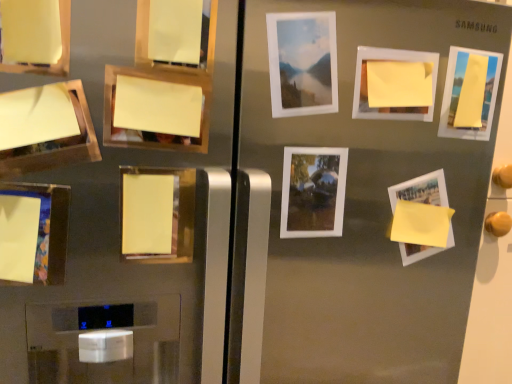
Question: Does matte yellow paper at upper left, which is the 3th picture frame in left-to-right order, have a greater height compared to yellow paper at upper left, the 10th picture frame positioned from the right?

Choices:
 (A) yes
 (B) no

Answer: (A)

Question: From the image's perspective, is matte yellow paper at upper left, which is the 3th picture frame in left-to-right order, on yellow paper at upper left, which appears as the 2th picture frame when viewed from the left?

Choices:
 (A) yes
 (B) no

Answer: (A)

Question: Is matte yellow paper at upper left, the ninth picture frame from the right, closer to camera compared to yellow paper at upper left, which appears as the 2th picture frame when viewed from the left?

Choices:
 (A) no
 (B) yes

Answer: (B)

Question: Considering the relative sizes of matte yellow paper at upper left, which is the 3th picture frame in left-to-right order, and yellow paper at upper left, which appears as the 2th picture frame when viewed from the left, in the image provided, is matte yellow paper at upper left, which is the 3th picture frame in left-to-right order, wider than yellow paper at upper left, which appears as the 2th picture frame when viewed from the left,?

Choices:
 (A) no
 (B) yes

Answer: (A)

Question: Does matte yellow paper at upper left, which is the 3th picture frame in left-to-right order, appear on the left side of yellow paper at upper left, the 10th picture frame positioned from the right?

Choices:
 (A) no
 (B) yes

Answer: (A)

Question: Would you say matte yellow paper at lower left, arranged as the 1th picture frame when viewed from the left, is inside or outside yellow matte paper at upper right, positioned as the third picture frame in right-to-left order?

Choices:
 (A) inside
 (B) outside

Answer: (B)

Question: From the image's perspective, is matte yellow paper at lower left, which appears as the 11th picture frame when viewed from the right, positioned above or below yellow matte paper at upper right, positioned as the third picture frame in right-to-left order?

Choices:
 (A) below
 (B) above

Answer: (A)

Question: Is point (13, 269) closer or farther from the camera than point (357, 54)?

Choices:
 (A) closer
 (B) farther

Answer: (A)

Question: From a real-world perspective, relative to yellow matte paper at upper right, positioned as the third picture frame in right-to-left order, is matte yellow paper at lower left, arranged as the 1th picture frame when viewed from the left, vertically above or below?

Choices:
 (A) above
 (B) below

Answer: (B)

Question: Considering the positions of yellow paper at upper left, the fifth picture frame when ordered from left to right, and matte white picture frame at upper center, which is counted as the 5th picture frame, starting from the right, in the image, is yellow paper at upper left, the fifth picture frame when ordered from left to right, wider or thinner than matte white picture frame at upper center, which is counted as the 5th picture frame, starting from the right,?

Choices:
 (A) wide
 (B) thin

Answer: (B)

Question: From a real-world perspective, is yellow paper at upper left, the fifth picture frame when ordered from left to right, positioned above or below matte white picture frame at upper center, which is counted as the 5th picture frame, starting from the right?

Choices:
 (A) above
 (B) below

Answer: (B)

Question: In the image, is yellow paper at upper left, arranged as the 7th picture frame when viewed from the right, on the left side or the right side of matte white picture frame at upper center, placed as the seventh picture frame when sorted from left to right?

Choices:
 (A) right
 (B) left

Answer: (B)

Question: In terms of size, does yellow paper at upper left, the fifth picture frame when ordered from left to right, appear bigger or smaller than matte white picture frame at upper center, placed as the seventh picture frame when sorted from left to right?

Choices:
 (A) small
 (B) big

Answer: (A)

Question: From a real-world perspective, is yellow matte paper at center, which appears as the fourth picture frame when viewed from the left, positioned above or below yellow paper at upper left, the 10th picture frame positioned from the right?

Choices:
 (A) above
 (B) below

Answer: (B)

Question: From the image's perspective, is yellow matte paper at center, which appears as the fourth picture frame when viewed from the left, located above or below yellow paper at upper left, which appears as the 2th picture frame when viewed from the left?

Choices:
 (A) above
 (B) below

Answer: (B)